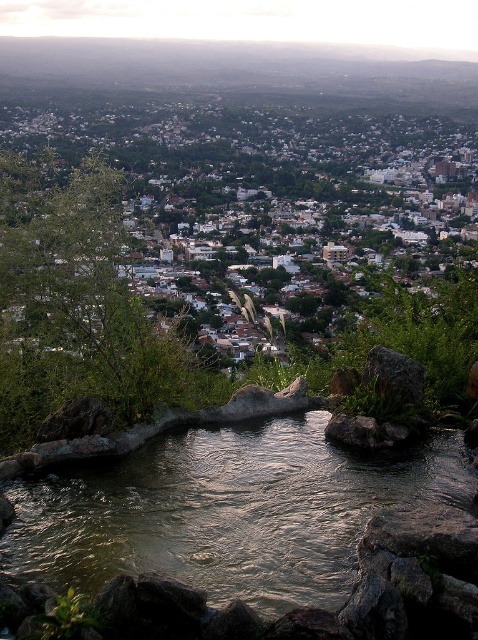
Is greenish-gray rock at center wider than gray rough rock at center?

Correct, the width of greenish-gray rock at center exceeds that of gray rough rock at center.

Which is behind, point (85, 557) or point (416, 368)?

The point (416, 368) is behind.

This screenshot has height=640, width=478. What are the coordinates of `greenish-gray rock at center` in the screenshot? It's located at (226, 512).